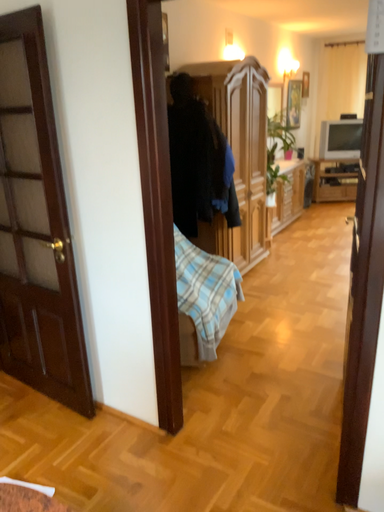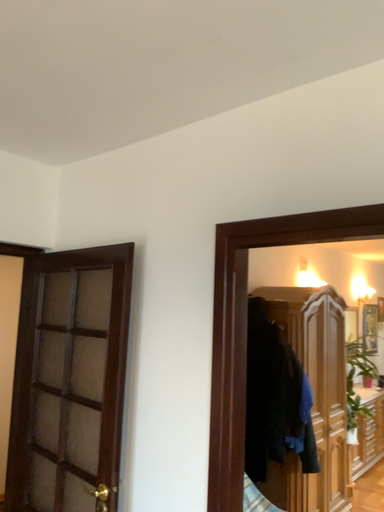
Question: Which way did the camera rotate in the video?

Choices:
 (A) rotated left
 (B) rotated right

Answer: (A)